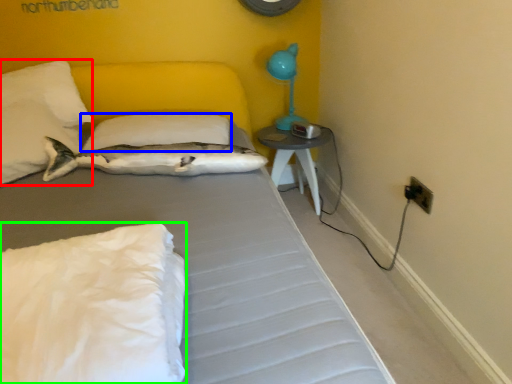
Question: Which object is the farthest from pillow (highlighted by a red box)? Choose among these: pillow (highlighted by a blue box) or pillow (highlighted by a green box).

Choices:
 (A) pillow
 (B) pillow

Answer: (B)